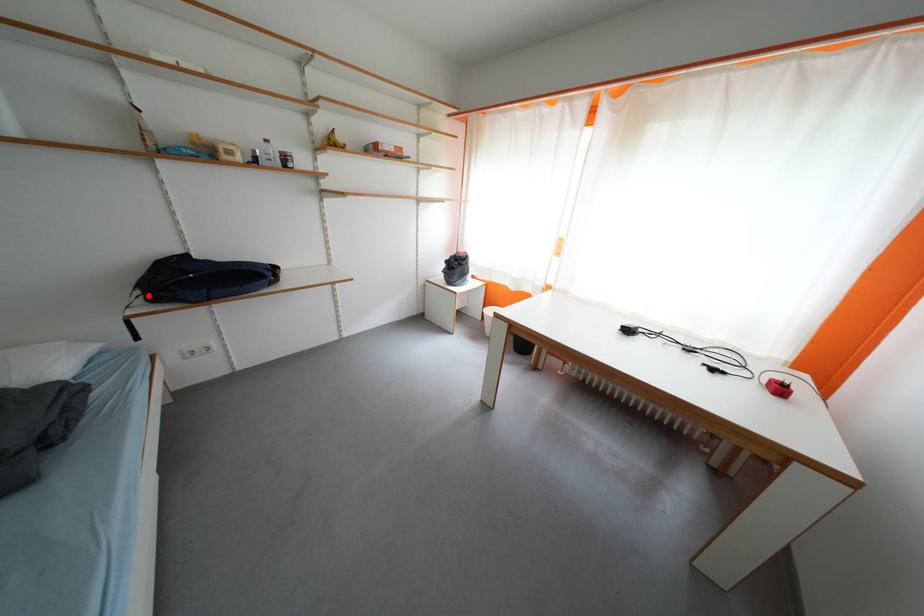
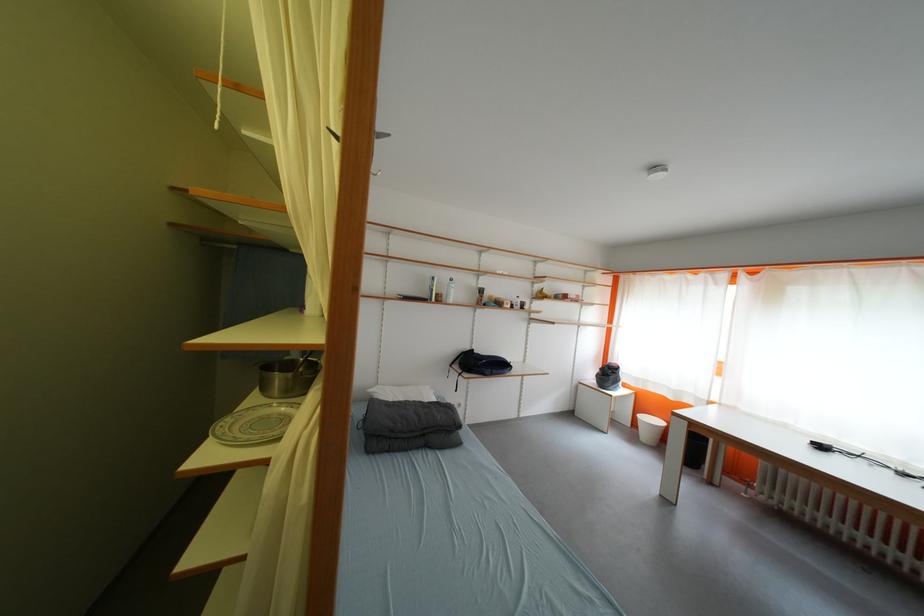
Question: I am providing you with two images of the same scene from different viewpoints. In image1, a red point is highlighted. Considering the same 3D point in image2, which of the following is correct?

Choices:
 (A) It is closer
 (B) It is farther

Answer: (B)